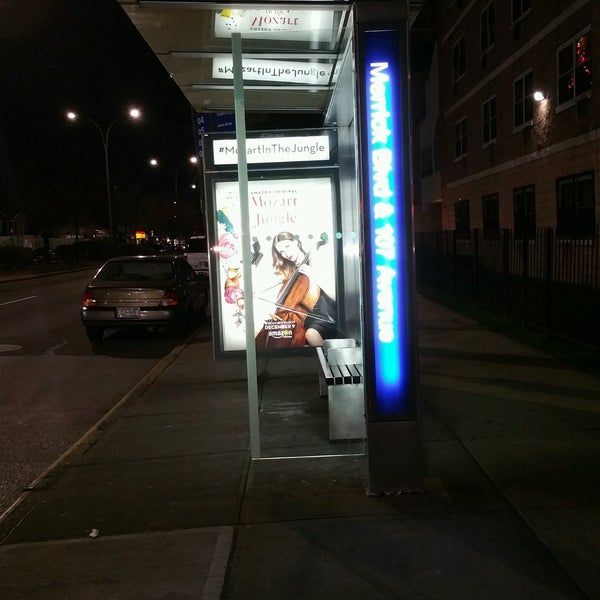
Locate an element on the screen. The width and height of the screenshot is (600, 600). place where you sit is located at coordinates (338, 382).